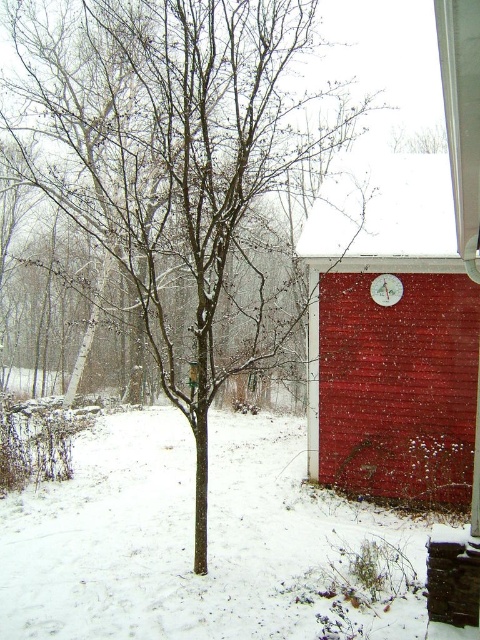
Question: Is bare branches at center below smooth red barn at center?

Choices:
 (A) yes
 (B) no

Answer: (B)

Question: Is bare branches at center further to the viewer compared to smooth red barn at center?

Choices:
 (A) no
 (B) yes

Answer: (A)

Question: Which point is farther to the camera?

Choices:
 (A) (322, 324)
 (B) (179, 209)

Answer: (B)

Question: Among these points, which one is farthest from the camera?

Choices:
 (A) (324, 221)
 (B) (171, 67)

Answer: (B)

Question: Does bare branches at center have a larger size compared to smooth red barn at center?

Choices:
 (A) yes
 (B) no

Answer: (A)